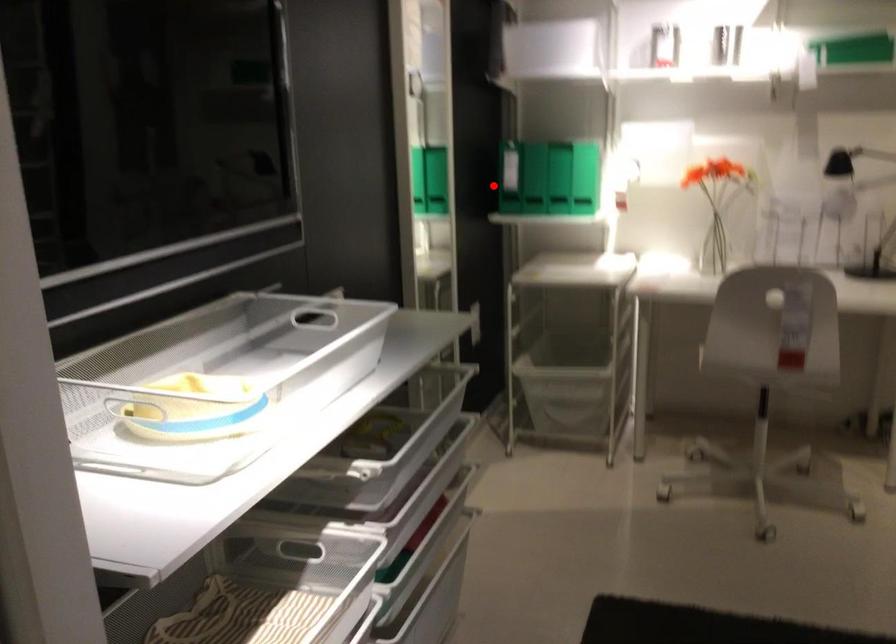
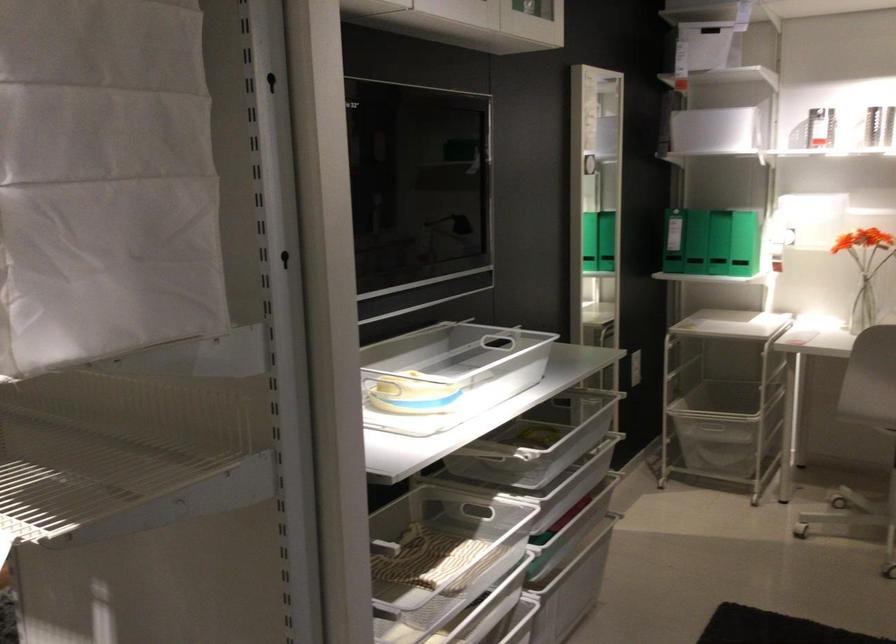
Find the pixel in the second image that matches the highlighted location in the first image.

(673, 241)